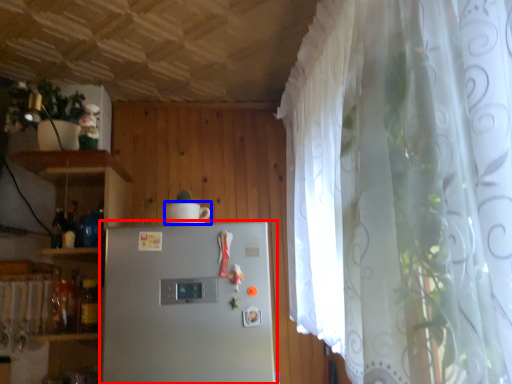
Question: Which point is further to the camera, refrigerator (highlighted by a red box) or appliance (highlighted by a blue box)?

Choices:
 (A) refrigerator
 (B) appliance

Answer: (B)